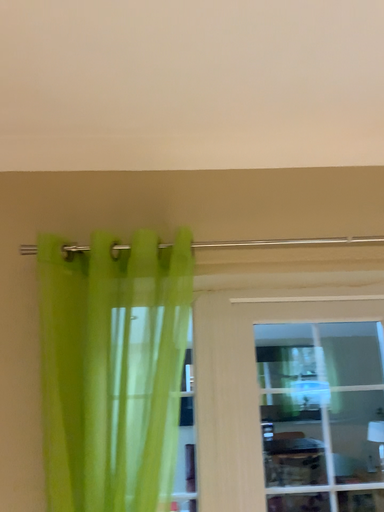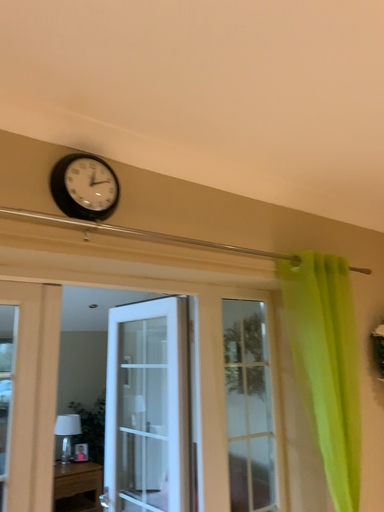
Question: Which way did the camera rotate in the video?

Choices:
 (A) rotated left
 (B) rotated right

Answer: (B)